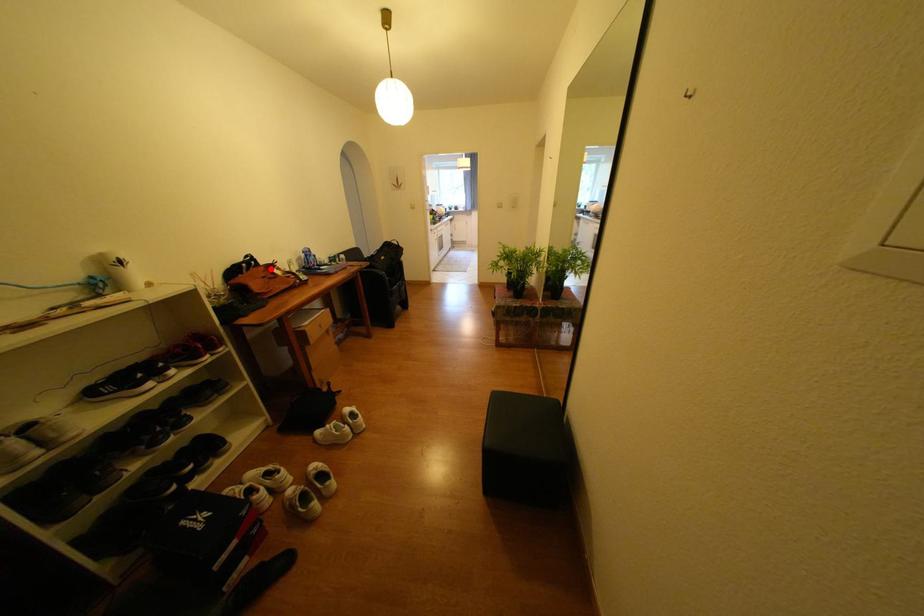
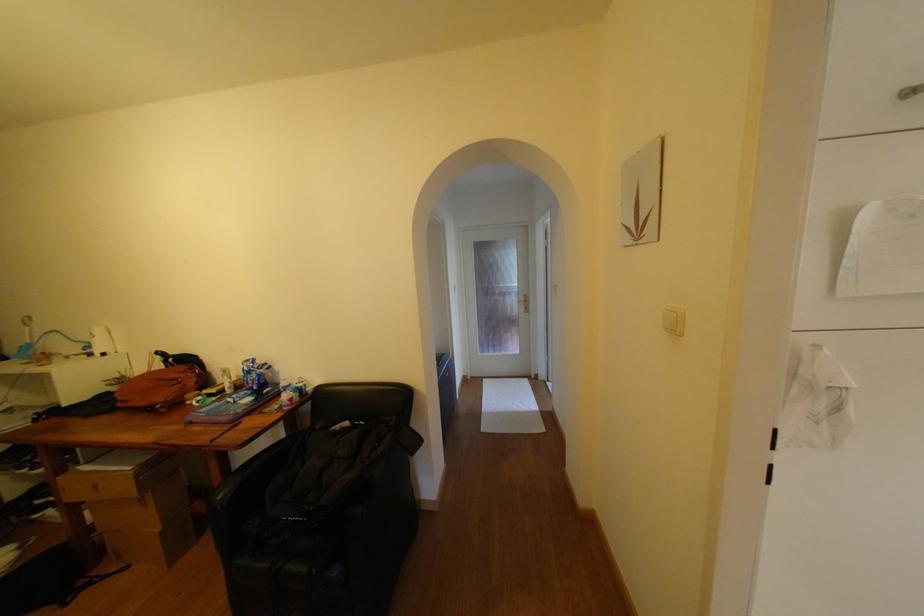
Question: I am providing you with two images of the same scene from different viewpoints. Image1 has a red point marked. In image2, the corresponding 3D location appears at what relative position? Reply with the corresponding letter.

Choices:
 (A) Closer
 (B) Farther

Answer: (B)